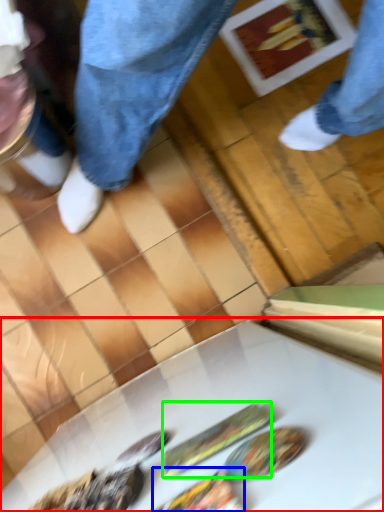
Question: Estimate the real-world distances between objects in this image. Which object is farther from table (highlighted by a red box), food (highlighted by a blue box) or food (highlighted by a green box)?

Choices:
 (A) food
 (B) food

Answer: (A)